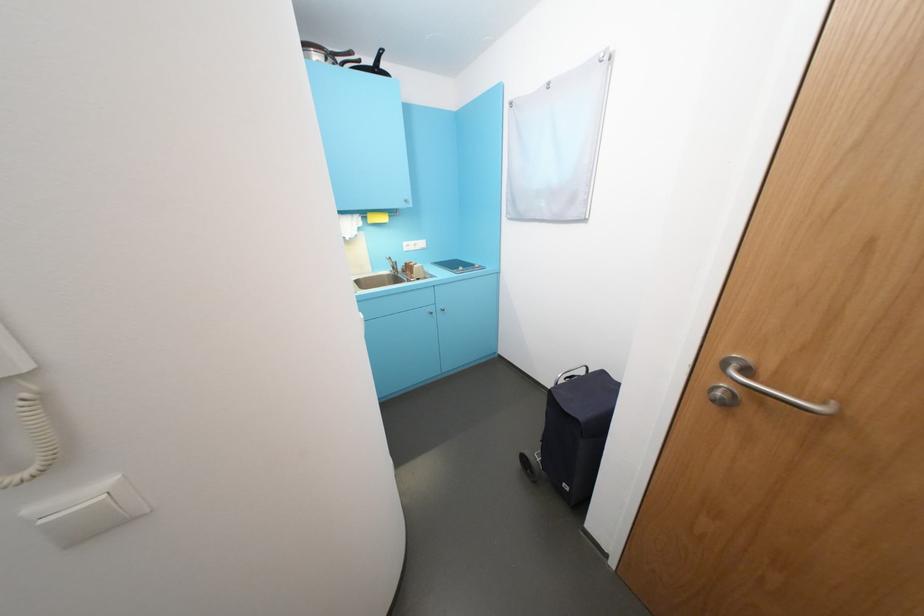
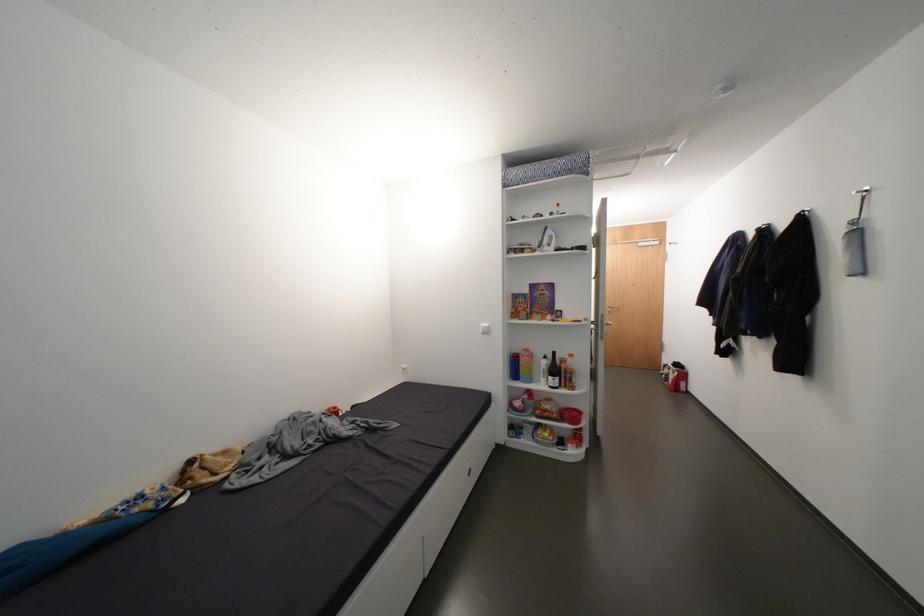
Where in the second image is the point corresponding to [726,394] from the first image?

(616, 310)